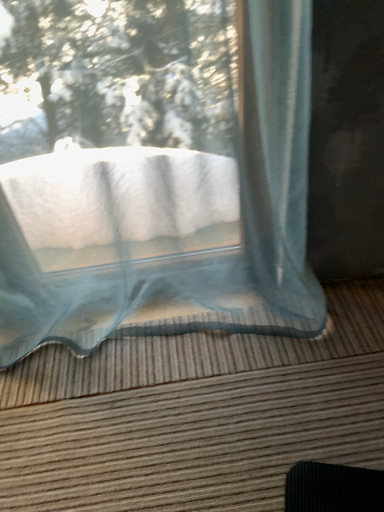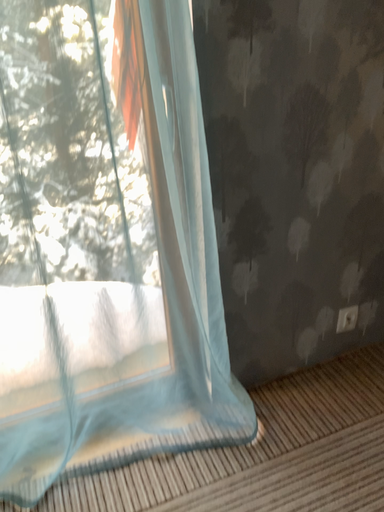
Question: Which way did the camera rotate in the video?

Choices:
 (A) rotated upward
 (B) rotated downward

Answer: (A)